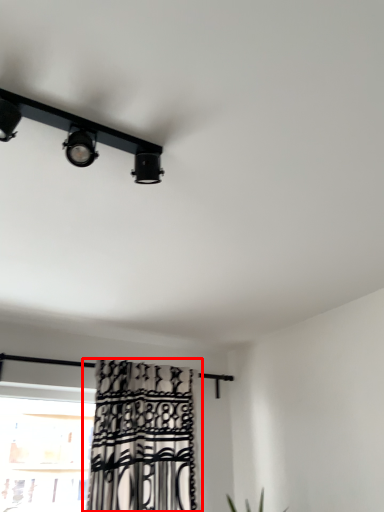
Question: Where is curtain (annotated by the red box) located in relation to lamp in the image?

Choices:
 (A) left
 (B) right

Answer: (B)